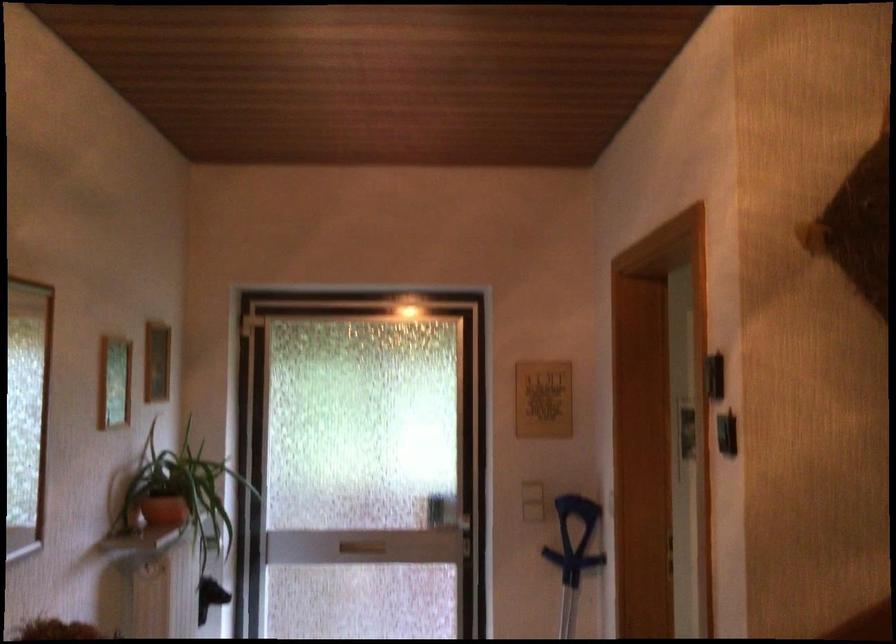
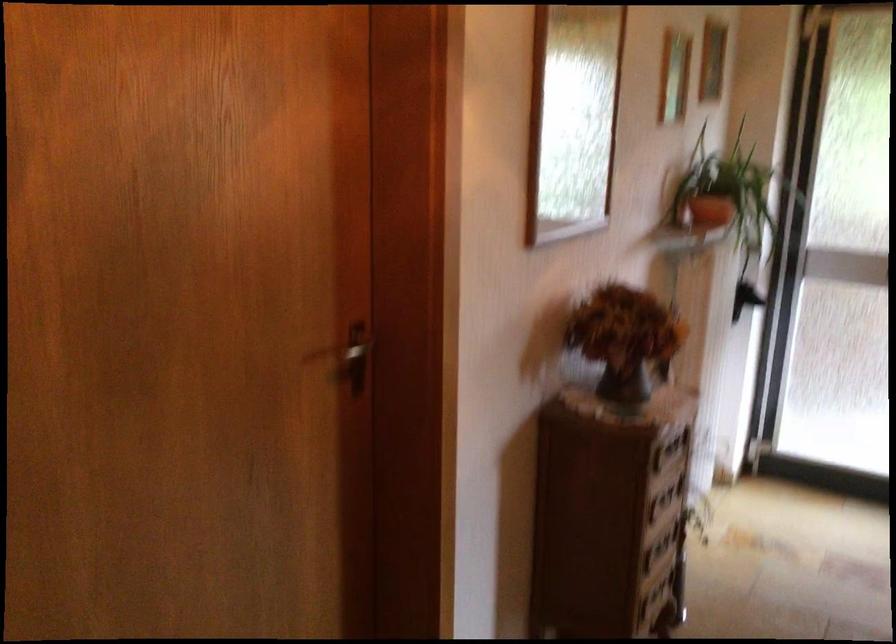
First-person continuous shooting, in which direction is the camera rotating?

The camera rotated toward left-down.